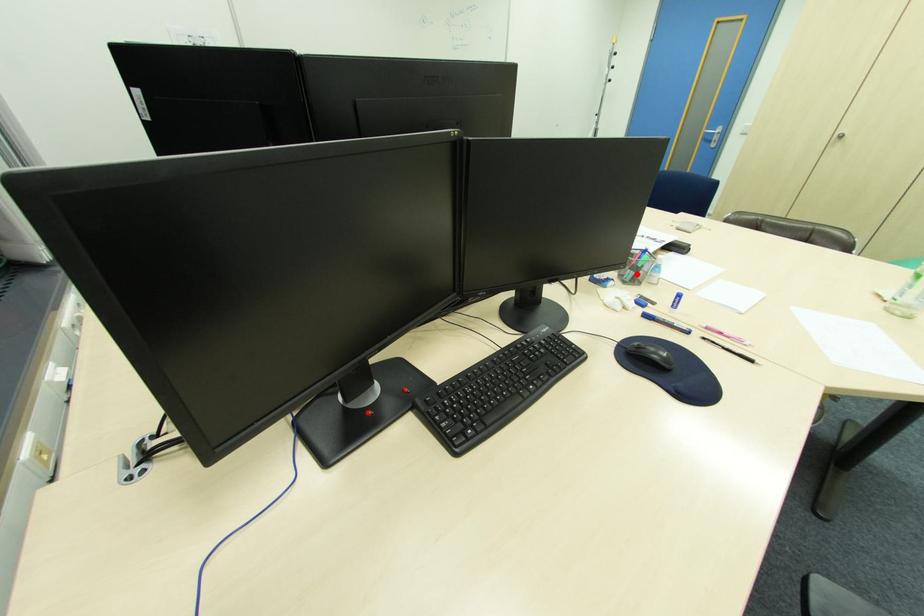
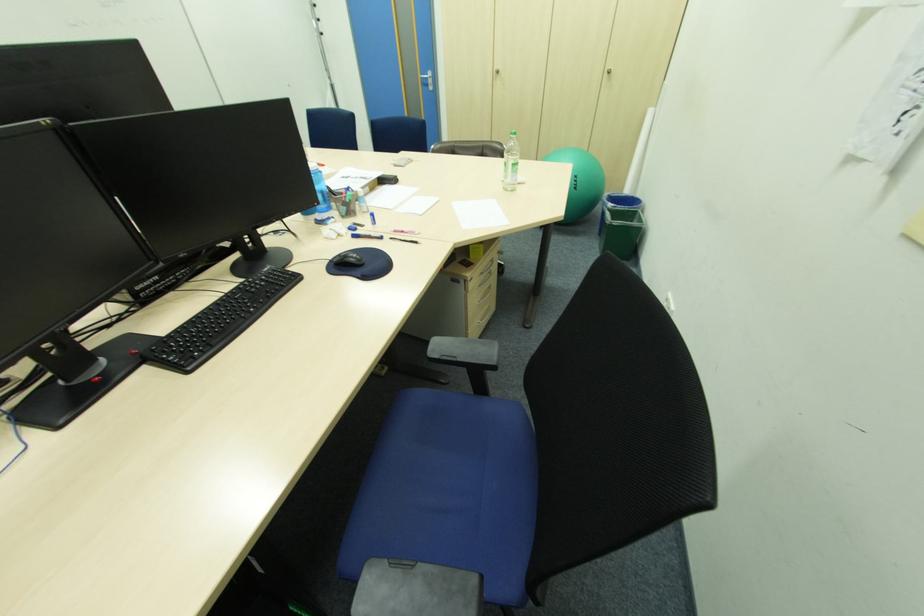
In the second image, find the point that corresponds to the highlighted location in the first image.

(349, 209)